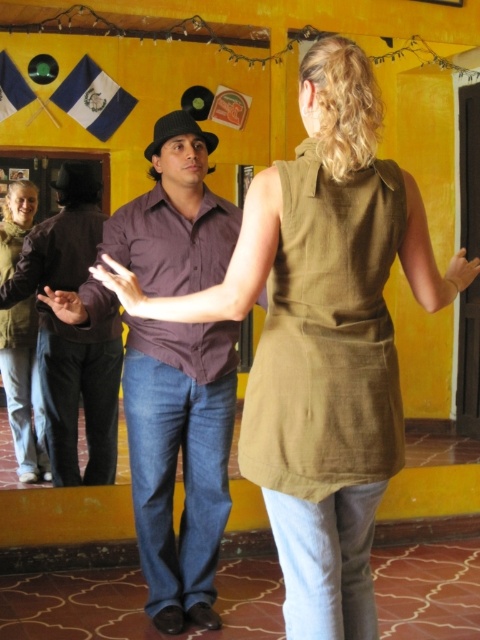
Question: Can you confirm if purple cotton shirt at center is positioned to the right of matte brown shirt at center?

Choices:
 (A) no
 (B) yes

Answer: (B)

Question: Among these points, which one is farthest from the camera?

Choices:
 (A) (3, 256)
 (B) (172, 467)

Answer: (A)

Question: Is matte brown shirt at center to the right of matte green jacket at left from the viewer's perspective?

Choices:
 (A) yes
 (B) no

Answer: (A)

Question: Which object is the closest to the matte brown shirt at center?

Choices:
 (A) purple cotton shirt at center
 (B) matte green jacket at left

Answer: (B)

Question: From the image, what is the correct spatial relationship of purple cotton shirt at center in relation to matte green jacket at left?

Choices:
 (A) above
 (B) below

Answer: (B)

Question: Among these objects, which one is nearest to the camera?

Choices:
 (A) matte green jacket at left
 (B) purple cotton shirt at center

Answer: (B)